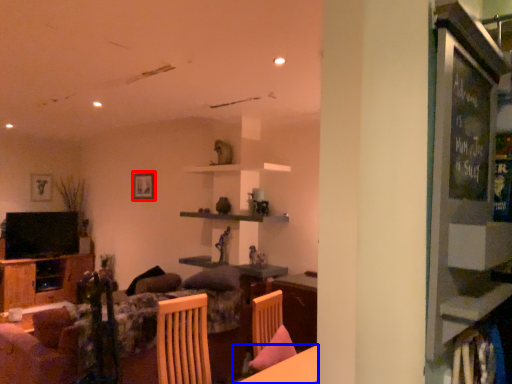
Question: Which object appears farthest to the camera in this image, picture frame (highlighted by a red box) or table (highlighted by a blue box)?

Choices:
 (A) picture frame
 (B) table

Answer: (A)